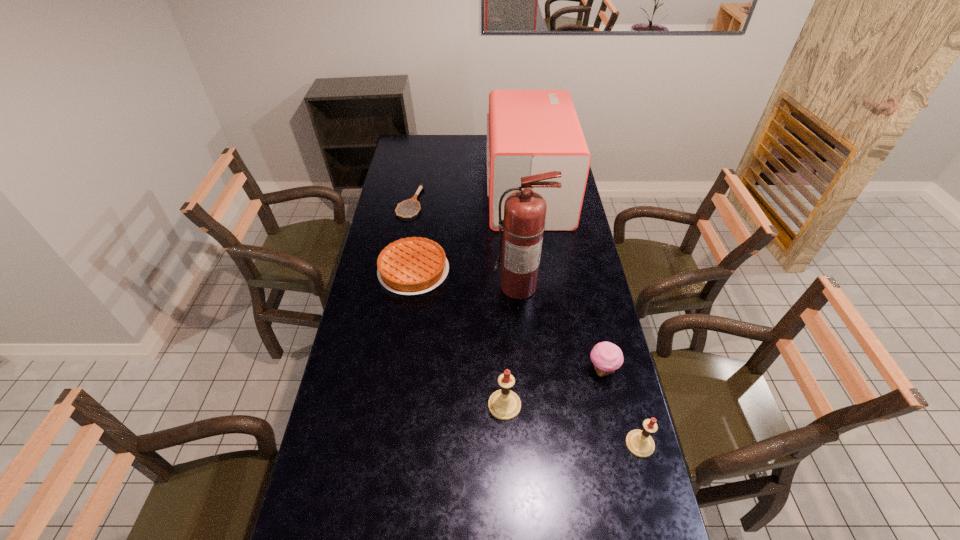
Find the location of a particular element. The width and height of the screenshot is (960, 540). tennis racket present at the left edge is located at coordinates (421, 186).

Find the location of `candle situated at the right edge`. candle situated at the right edge is located at coordinates point(640,443).

This screenshot has height=540, width=960. What are the coordinates of `box that is positioned at the right edge` in the screenshot? It's located at (529, 132).

Find the location of a particular element. The image size is (960, 540). cupcake that is at the right edge is located at coordinates (607, 357).

Locate an element on the screen. vacant space at the far edge of the desktop is located at coordinates (449, 155).

Image resolution: width=960 pixels, height=540 pixels. Identify the location of vacant space at the near edge of the desktop. (530, 508).

In the image, there is a desktop. Identify the location of vacant area at the left edge. The image size is (960, 540). (356, 349).

Identify the location of free space at the right edge. (564, 245).

Locate an element on the screen. The width and height of the screenshot is (960, 540). vacant point located between the sixth shortest object and the cupcake is located at coordinates (565, 281).

The width and height of the screenshot is (960, 540). I want to click on vacant area that lies between the right candle and the second nearest object, so pos(572,424).